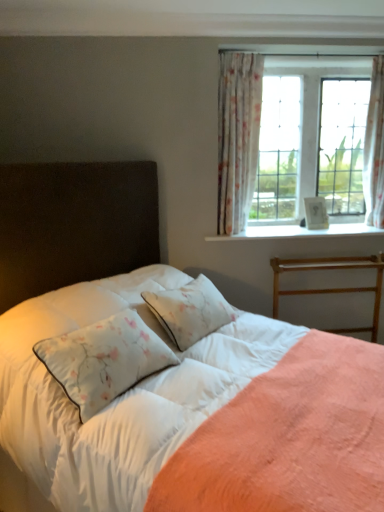
Image resolution: width=384 pixels, height=512 pixels. Identify the location of white textured wood at upper right. (299, 232).

What do you see at coordinates (299, 232) in the screenshot? The width and height of the screenshot is (384, 512). I see `white textured wood at upper right` at bounding box center [299, 232].

Describe the element at coordinates (332, 288) in the screenshot. I see `wooden bed frame at right` at that location.

The width and height of the screenshot is (384, 512). Describe the element at coordinates (238, 137) in the screenshot. I see `floral sheer curtain at upper right, which appears as the first curtain when viewed from the left` at that location.

Locate an element on the screen. This screenshot has width=384, height=512. white textured wood at upper right is located at coordinates (299, 232).

Does wooden bed frame at right have a greater height compared to white textured wood at upper right?

Yes, wooden bed frame at right is taller than white textured wood at upper right.

Between wooden bed frame at right and white textured wood at upper right, which one is positioned behind?

Positioned behind is white textured wood at upper right.

What's the angular difference between wooden bed frame at right and white textured wood at upper right's facing directions?

There is a 0.000457-degree angle between the facing directions of wooden bed frame at right and white textured wood at upper right.

From a real-world perspective, which object stands above the other?

white textured wood at upper right is physically above.

Who is more distant, wooden bed frame at right or white floral fabric curtain at upper right, acting as the first curtain starting from the right?

white floral fabric curtain at upper right, acting as the first curtain starting from the right, is further from the camera.

Is white floral fabric curtain at upper right, acting as the first curtain starting from the right, at the back of wooden bed frame at right?

No, wooden bed frame at right is not facing away from white floral fabric curtain at upper right, acting as the first curtain starting from the right.

Can you confirm if wooden bed frame at right is bigger than white floral fabric curtain at upper right, acting as the first curtain starting from the right?

Yes, wooden bed frame at right is bigger than white floral fabric curtain at upper right, acting as the first curtain starting from the right.

Identify the location of curtain that appears behind the wooden bed frame at right. The height and width of the screenshot is (512, 384). (375, 148).

Would you consider white textured wood at upper right to be distant from wooden bed frame at right?

No, white textured wood at upper right is in close proximity to wooden bed frame at right.

Can wooden bed frame at right be found inside white textured wood at upper right?

No, wooden bed frame at right is located outside of white textured wood at upper right.

How different are the orientations of white textured wood at upper right and wooden bed frame at right in degrees?

0.000457 degrees.

Is point (145, 434) closer or farther from the camera than point (283, 224)?

Clearly, point (145, 434) is closer to the camera than point (283, 224).

In the scene shown: How much distance is there between white satin sheet at center and white textured wood at upper right?

The distance of white satin sheet at center from white textured wood at upper right is 1.41 meters.

What's the angular difference between white satin sheet at center and white textured wood at upper right's facing directions?

white satin sheet at center and white textured wood at upper right are facing 45.7 degrees away from each other.

Is white satin sheet at center positioned with its back to white textured wood at upper right?

No, white textured wood at upper right is not at the back of white satin sheet at center.

Is white satin sheet at center not inside wooden bed frame at right?

Yes, white satin sheet at center is not within wooden bed frame at right.

Is point (18, 410) positioned behind point (334, 269)?

No, (18, 410) is in front of (334, 269).

From the picture: Can you tell me how much white satin sheet at center and wooden bed frame at right differ in facing direction?

They differ by 45.7 degrees in their facing directions.

In the scene shown: Is white satin sheet at center to the left or to the right of wooden bed frame at right in the image?

Clearly, white satin sheet at center is on the left of wooden bed frame at right in the image.

Is wooden bed frame at right aimed at white soft bed at center?

Yes, wooden bed frame at right faces towards white soft bed at center.

In terms of size, does wooden bed frame at right appear bigger or smaller than white soft bed at center?

Clearly, wooden bed frame at right is smaller in size than white soft bed at center.

Which object is positioned more to the left, wooden bed frame at right or white soft bed at center?

Positioned to the left is white soft bed at center.

Who is taller, wooden bed frame at right or white soft bed at center?

Standing taller between the two is white soft bed at center.

Which of these two, white satin sheet at center or floral sheer curtain at upper right, which appears as the first curtain when viewed from the left, is thinner?

floral sheer curtain at upper right, which appears as the first curtain when viewed from the left, is thinner.

Can you tell me how much white satin sheet at center and floral sheer curtain at upper right, which appears as the first curtain when viewed from the left, differ in facing direction?

The facing directions of white satin sheet at center and floral sheer curtain at upper right, which appears as the first curtain when viewed from the left, are 45.7 degrees apart.

Which object is further away from the camera taking this photo, white satin sheet at center or floral sheer curtain at upper right, which appears as the first curtain when viewed from the left?

floral sheer curtain at upper right, which appears as the first curtain when viewed from the left, is further away from the camera.

From the image's perspective, is white satin sheet at center over floral sheer curtain at upper right, which appears as the first curtain when viewed from the left?

No, from the image's perspective, white satin sheet at center is not above floral sheer curtain at upper right, which appears as the first curtain when viewed from the left.

This screenshot has height=512, width=384. Identify the location of bed frame lying on the right of white textured wood at upper right. (332, 288).

You are a GUI agent. You are given a task and a screenshot of the screen. Output one action in this format:
    pyautogui.click(x=<x>, y=<y>)
    Task: Click on the bed frame below the white floral fabric curtain at upper right, acting as the first curtain starting from the right (from the image's perspective)
    The height and width of the screenshot is (512, 384).
    Given the screenshot: What is the action you would take?
    tap(332, 288)

When comparing their distances from white soft bed at center, does floral sheer curtain at upper right, which appears as the first curtain when viewed from the left, or wooden bed frame at right seem further?

wooden bed frame at right is positioned further to the anchor white soft bed at center.

From the image, which object appears to be farther from white textured wood at upper right, white floral fabric curtain at upper right, arranged as the 2th curtain when viewed from the left, or white soft bed at center?

Based on the image, white soft bed at center appears to be further to white textured wood at upper right.

Based on their spatial positions, is white textured wood at upper right or white floral fabric curtain at upper right, arranged as the 2th curtain when viewed from the left, further from floral sheer curtain at upper right, which appears as the first curtain when viewed from the left?

Among the two, white floral fabric curtain at upper right, arranged as the 2th curtain when viewed from the left, is located further to floral sheer curtain at upper right, which appears as the first curtain when viewed from the left.

From the image, which object appears to be nearer to floral sheer curtain at upper right, marked as the 2th curtain in a right-to-left arrangement, white satin sheet at center or white textured wood at upper right?

white textured wood at upper right is closer to floral sheer curtain at upper right, marked as the 2th curtain in a right-to-left arrangement.

Based on their spatial positions, is white textured wood at upper right or floral sheer curtain at upper right, marked as the 2th curtain in a right-to-left arrangement, closer to wooden bed frame at right?

white textured wood at upper right.

When comparing their distances from white satin sheet at center, does floral sheer curtain at upper right, marked as the 2th curtain in a right-to-left arrangement, or white textured wood at upper right seem further?

floral sheer curtain at upper right, marked as the 2th curtain in a right-to-left arrangement, lies further to white satin sheet at center than the other object.

Looking at the image, which one is located further to white floral fabric curtain at upper right, arranged as the 2th curtain when viewed from the left, white soft bed at center or white textured wood at upper right?

white soft bed at center.

Considering their positions, is white textured wood at upper right positioned closer to wooden bed frame at right than white soft bed at center?

white textured wood at upper right is positioned closer to the anchor wooden bed frame at right.

The image size is (384, 512). I want to click on bed frame between white satin sheet at center and white textured wood at upper right from front to back, so click(332, 288).

Identify the location of curtain located between white satin sheet at center and wooden bed frame at right in the depth direction. (238, 137).

Locate an element on the screen. This screenshot has height=512, width=384. sheet between white soft bed at center and white floral fabric curtain at upper right, arranged as the 2th curtain when viewed from the left, from front to back is located at coordinates (147, 419).

What are the coordinates of `sheet positioned between white soft bed at center and white textured wood at upper right from near to far` in the screenshot? It's located at (147, 419).